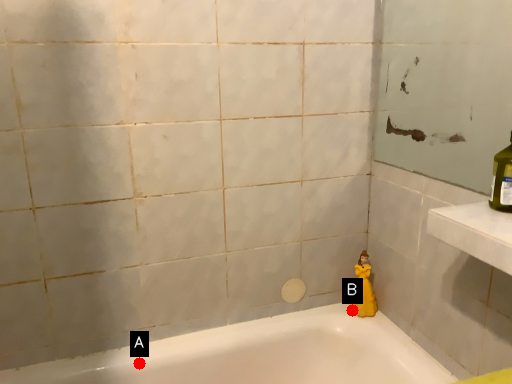
Question: Two points are circled on the image, labeled by A and B beside each circle. Which point is further to the camera?

Choices:
 (A) A is further
 (B) B is further

Answer: (B)